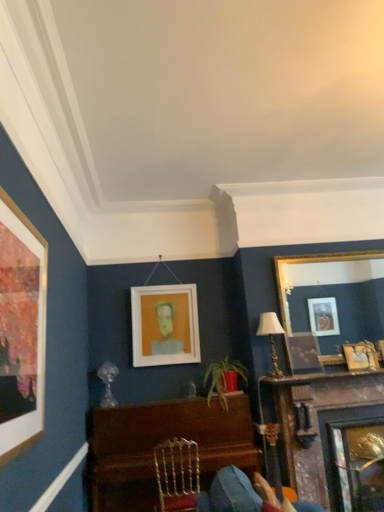
Question: Is matte gold lampshade at upper right located within gold/gilded mirror at upper right, the 2th picture frame from the right?

Choices:
 (A) yes
 (B) no

Answer: (B)

Question: Is gold/gilded mirror at upper right, the 2th picture frame from the right, taller than matte gold lampshade at upper right?

Choices:
 (A) yes
 (B) no

Answer: (A)

Question: Is gold/gilded mirror at upper right, the 2th picture frame from the right, further to the viewer compared to matte gold lampshade at upper right?

Choices:
 (A) no
 (B) yes

Answer: (B)

Question: Does gold/gilded mirror at upper right, the 2th picture frame from the right, have a smaller size compared to matte gold lampshade at upper right?

Choices:
 (A) yes
 (B) no

Answer: (B)

Question: Is gold/gilded mirror at upper right, the 3th picture frame in the left-to-right sequence, in front of matte gold lampshade at upper right?

Choices:
 (A) yes
 (B) no

Answer: (B)

Question: From a real-world perspective, does gold/gilded mirror at upper right, the 2th picture frame from the right, sit lower than matte gold lampshade at upper right?

Choices:
 (A) yes
 (B) no

Answer: (B)

Question: From the image's perspective, does gold/gilded mirror at upper right, the 3th picture frame in the left-to-right sequence, appear lower than gold metallic chair at center?

Choices:
 (A) no
 (B) yes

Answer: (A)

Question: Is gold/gilded mirror at upper right, the 3th picture frame in the left-to-right sequence, touching gold metallic chair at center?

Choices:
 (A) yes
 (B) no

Answer: (B)

Question: Are gold/gilded mirror at upper right, the 3th picture frame in the left-to-right sequence, and gold metallic chair at center far apart?

Choices:
 (A) yes
 (B) no

Answer: (A)

Question: Is gold/gilded mirror at upper right, the 2th picture frame from the right, shorter than gold metallic chair at center?

Choices:
 (A) yes
 (B) no

Answer: (B)

Question: From the image's perspective, is gold/gilded mirror at upper right, the 3th picture frame in the left-to-right sequence, over gold metallic chair at center?

Choices:
 (A) yes
 (B) no

Answer: (A)

Question: Does gold/gilded mirror at upper right, the 2th picture frame from the right, have a smaller size compared to gold metallic chair at center?

Choices:
 (A) no
 (B) yes

Answer: (A)

Question: From a real-world perspective, is gold/gilded mirror at upper right, the 3th picture frame in the left-to-right sequence, beneath matte gold picture frame at upper right, marked as the 1th picture frame in a right-to-left arrangement?

Choices:
 (A) no
 (B) yes

Answer: (A)